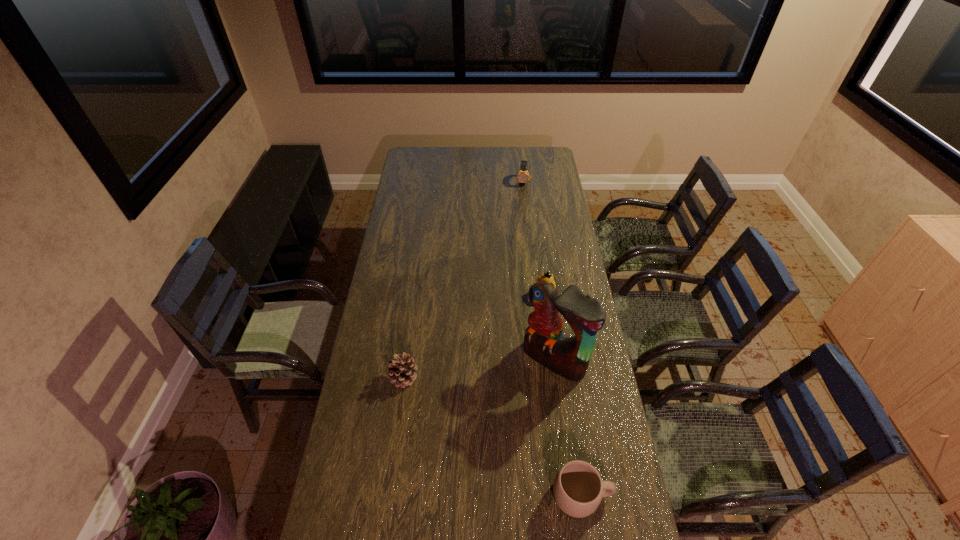
Where is `vacant space located on the face of the fourth nearest object`? vacant space located on the face of the fourth nearest object is located at coordinates (534, 311).

Identify the location of vacant space located 0.330m on the face of the fourth nearest object. (503, 356).

Where is `vacant area located on the face of the watch`? This screenshot has height=540, width=960. vacant area located on the face of the watch is located at coordinates (522, 196).

Where is `free spot located 0.210m on the face of the watch`? free spot located 0.210m on the face of the watch is located at coordinates (521, 211).

Where is `free point located 0.270m on the face of the watch`? The width and height of the screenshot is (960, 540). free point located 0.270m on the face of the watch is located at coordinates pos(521,218).

You are a GUI agent. You are given a task and a screenshot of the screen. Output one action in this format:
    pyautogui.click(x=<x>, y=<y>)
    Task: Click on the object that is at the near edge
    The height and width of the screenshot is (540, 960).
    Given the screenshot: What is the action you would take?
    pyautogui.click(x=578, y=489)

Identify the location of object positioned at the left edge. (401, 370).

Find the location of `mug situated at the right edge`. mug situated at the right edge is located at coordinates (578, 489).

The height and width of the screenshot is (540, 960). In order to click on parrot that is positioned at the right edge in this screenshot , I will do `click(543, 340)`.

What are the coordinates of `duckling at the right edge` in the screenshot? It's located at (546, 277).